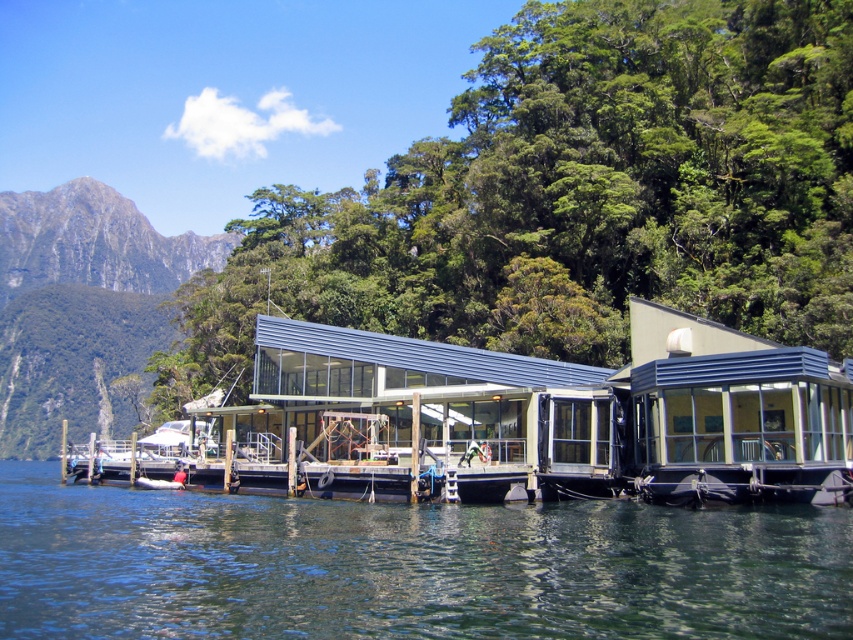
In the scene shown: You are standing at the point marked as point (526,572) in the image. The structure ahead is 19.84 meters away from you. If you walk straight towards the structure, will you reach it before the distance becomes less than 10 meters?

Yes, because the distance from point (526,572) to the structure is 19.84 meters, so walking straight towards it will reduce the distance until you reach it, which is before it becomes less than 10 meters.

You are designing a new floating platform and need to ensure it aligns with the existing structure. The transparent water at lower center and the matte glass building at center are key elements. Which of these two has a greater horizontal span in the image?

The transparent water at lower center has a greater horizontal span than the matte glass building at center, as its width is larger according to the description.

You are a visitor standing on the shore looking at the transparent water at lower center and the matte glass building at center. Which one appears taller from your perspective?

The transparent water at lower center has a greater height compared to the matte glass building at center, so the transparent water at lower center appears taller from your perspective.